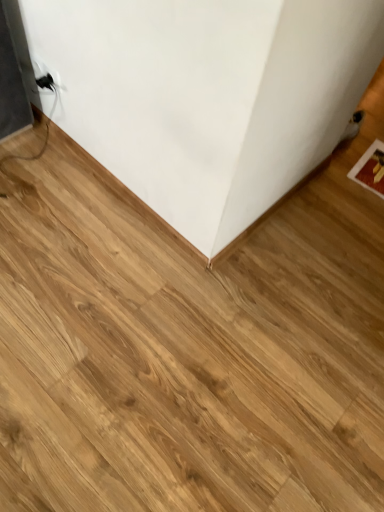
Find the location of a particular element. The image size is (384, 512). black plastic electric outlet at upper left is located at coordinates (46, 76).

This screenshot has height=512, width=384. What do you see at coordinates (46, 76) in the screenshot?
I see `black plastic electric outlet at upper left` at bounding box center [46, 76].

What is the approximate height of black plastic electric outlet at upper left?

It is 3.24 inches.

The width and height of the screenshot is (384, 512). What do you see at coordinates (207, 96) in the screenshot? I see `wooden floor at center` at bounding box center [207, 96].

The width and height of the screenshot is (384, 512). Identify the location of wooden floor at center. (207, 96).

You are a GUI agent. You are given a task and a screenshot of the screen. Output one action in this format:
    pyautogui.click(x=<x>, y=<y>)
    Task: Click on the black plastic electric outlet at upper left
    
    Given the screenshot: What is the action you would take?
    pyautogui.click(x=46, y=76)

Does wooden floor at center appear on the right side of black plastic electric outlet at upper left?

Yes.

Between wooden floor at center and black plastic electric outlet at upper left, which one is positioned in front?

wooden floor at center is closer to the camera.

Considering the points (31, 4) and (51, 86), which point is behind, point (31, 4) or point (51, 86)?

Point (51, 86)

From the image's perspective, is wooden floor at center located above or below black plastic electric outlet at upper left?

From the image's perspective, wooden floor at center appears below black plastic electric outlet at upper left.

From a real-world perspective, is wooden floor at center under black plastic electric outlet at upper left?

Yes, from a real-world perspective, wooden floor at center is under black plastic electric outlet at upper left.

Consider the image. Considering the sizes of objects wooden floor at center and black plastic electric outlet at upper left in the image provided, who is thinner, wooden floor at center or black plastic electric outlet at upper left?

Thinner between the two is black plastic electric outlet at upper left.

Considering the relative sizes of wooden floor at center and black plastic electric outlet at upper left in the image provided, is wooden floor at center shorter than black plastic electric outlet at upper left?

Correct, wooden floor at center is not as tall as black plastic electric outlet at upper left.

Considering the sizes of objects wooden floor at center and black plastic electric outlet at upper left in the image provided, who is bigger, wooden floor at center or black plastic electric outlet at upper left?

wooden floor at center is bigger.

Choose the correct answer: Is wooden floor at center inside black plastic electric outlet at upper left or outside it?

wooden floor at center lies outside black plastic electric outlet at upper left.

Consider the image. Is wooden floor at center not near black plastic electric outlet at upper left?

That's not correct — wooden floor at center is a little close to black plastic electric outlet at upper left.

Is wooden floor at center oriented towards black plastic electric outlet at upper left?

No.

How different are the orientations of wooden floor at center and black plastic electric outlet at upper left in degrees?

They differ by 1.65 degrees in their facing directions.

How distant is wooden floor at center from black plastic electric outlet at upper left?

wooden floor at center and black plastic electric outlet at upper left are 21.13 inches apart.

Locate an element on the screen. furniture in front of the black plastic electric outlet at upper left is located at coordinates (207, 96).

Is black plastic electric outlet at upper left at the right side of wooden floor at center?

In fact, black plastic electric outlet at upper left is to the left of wooden floor at center.

Which object is more forward, black plastic electric outlet at upper left or wooden floor at center?

wooden floor at center is more forward.

Which is closer to the camera, (41, 87) or (62, 1)?

Positioned in front is point (62, 1).

From the image's perspective, between black plastic electric outlet at upper left and wooden floor at center, which one is located above?

black plastic electric outlet at upper left appears higher in the image.

From a real-world perspective, which is physically below, black plastic electric outlet at upper left or wooden floor at center?

In real-world perspective, wooden floor at center is lower.

Considering the relative sizes of black plastic electric outlet at upper left and wooden floor at center in the image provided, is black plastic electric outlet at upper left thinner than wooden floor at center?

Yes.

Considering the relative sizes of black plastic electric outlet at upper left and wooden floor at center in the image provided, is black plastic electric outlet at upper left taller than wooden floor at center?

Indeed, black plastic electric outlet at upper left has a greater height compared to wooden floor at center.

Which of these two, black plastic electric outlet at upper left or wooden floor at center, is bigger?

wooden floor at center is bigger.

Is wooden floor at center completely or partially inside black plastic electric outlet at upper left?

No, wooden floor at center is not a part of black plastic electric outlet at upper left.

Are black plastic electric outlet at upper left and wooden floor at center making contact?

No, black plastic electric outlet at upper left is not with wooden floor at center.

Is black plastic electric outlet at upper left aimed at wooden floor at center?

No, black plastic electric outlet at upper left is not facing towards wooden floor at center.

Measure the distance from black plastic electric outlet at upper left to wooden floor at center.

black plastic electric outlet at upper left is 21.13 inches away from wooden floor at center.

This screenshot has height=512, width=384. I want to click on furniture on the right of black plastic electric outlet at upper left, so click(207, 96).

Locate an element on the screen. The height and width of the screenshot is (512, 384). furniture located in front of the black plastic electric outlet at upper left is located at coordinates (207, 96).

Identify the location of electric outlet positioned vertically above the wooden floor at center (from a real-world perspective). This screenshot has width=384, height=512. (46, 76).